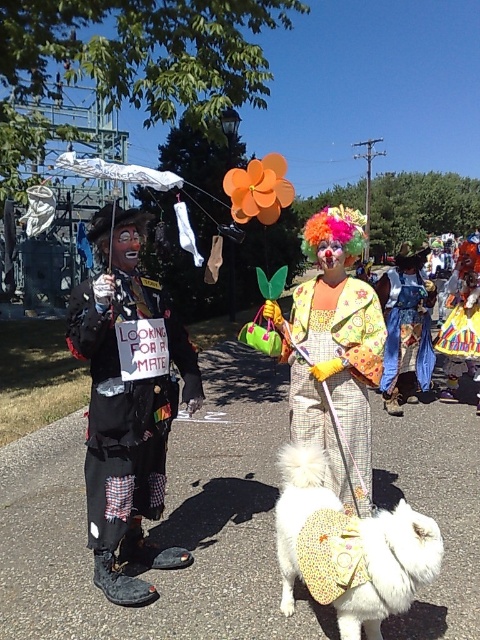
Does white fur dog at center lie behind denim dress at center?

No, white fur dog at center is closer to the viewer.

Is white fur dog at center below denim dress at center?

Yes.

Image resolution: width=480 pixels, height=640 pixels. In order to click on white fur dog at center in this screenshot , I will do `click(360, 547)`.

Where is `white fur dog at center`? white fur dog at center is located at coordinates (360, 547).

Can you confirm if fluffy white dog at center is smaller than white fur dog at center?

Indeed, fluffy white dog at center has a smaller size compared to white fur dog at center.

Is point (308, 314) in front of point (372, 573)?

No, it is behind (372, 573).

Is point (291, 323) more distant than point (288, 544)?

Yes, point (291, 323) is behind point (288, 544).

Find the location of a particular element. This screenshot has height=640, width=480. fluffy white dog at center is located at coordinates (336, 380).

Which is below, black leather outfit at left or white fur dog at center?

white fur dog at center

From the picture: Between black leather outfit at left and white fur dog at center, which one has more height?

black leather outfit at left is taller.

Between point (123, 512) and point (400, 605), which one is positioned behind?

The point (123, 512) is behind.

This screenshot has height=640, width=480. In order to click on black leather outfit at left in this screenshot , I will do `click(127, 404)`.